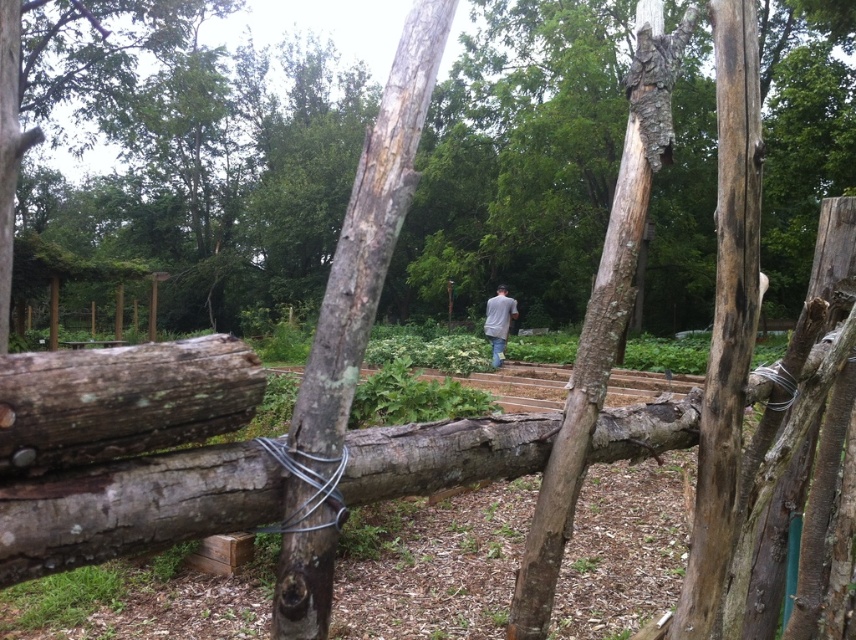
You are standing in the garden and see the smooth brown tree trunk at center and the gray matte shirt at center. Which object is closer to you?

The smooth brown tree trunk at center is closer to you because it is in front of the gray matte shirt at center.

Based on the photo, you are standing in the garden and see the smooth brown tree trunk at center and the gray matte shirt at center. Which object is closer to the ground?

The smooth brown tree trunk at center is closer to the ground because it is positioned below the gray matte shirt at center.